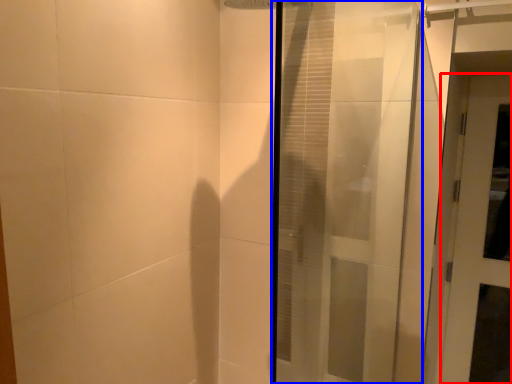
Question: Which object appears closest to the camera in this image, door (highlighted by a red box) or door (highlighted by a blue box)?

Choices:
 (A) door
 (B) door

Answer: (B)